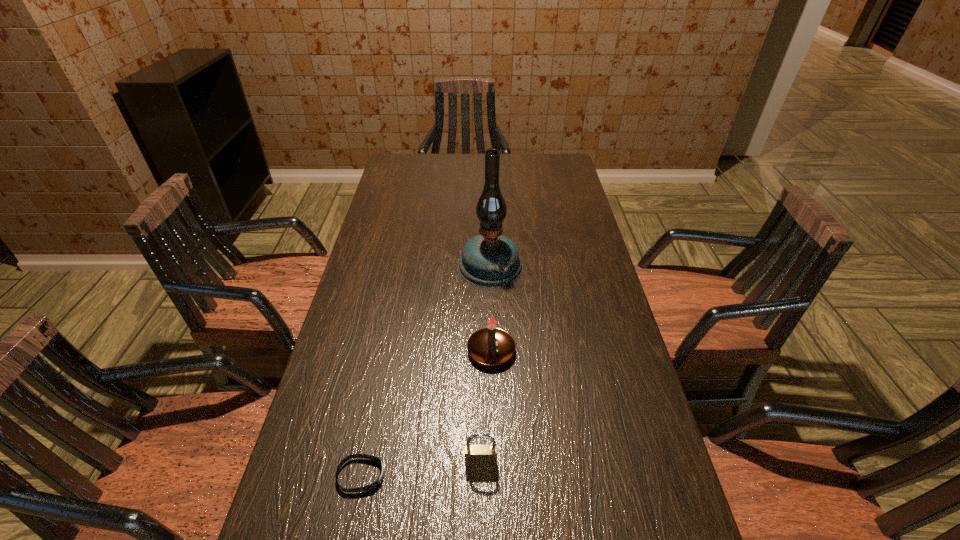
This screenshot has height=540, width=960. I want to click on vacant region between the farthest object and the leftmost object, so click(425, 370).

The height and width of the screenshot is (540, 960). I want to click on free space between the oil lamp and the leftmost object, so click(425, 370).

The height and width of the screenshot is (540, 960). I want to click on empty space that is in between the leftmost object and the padlock, so click(x=421, y=469).

Locate an element on the screen. vacant area that lies between the candle and the leftmost object is located at coordinates (426, 413).

This screenshot has width=960, height=540. Find the location of `empty location between the candle and the second shortest object`. empty location between the candle and the second shortest object is located at coordinates (486, 407).

Identify the location of object that can be found as the third closest to the farthest object. Image resolution: width=960 pixels, height=540 pixels. (372, 486).

Locate which object is the closest to the wristband. Please provide its 2D coordinates. Your answer should be formatted as a tuple, i.e. [(x, y)], where the tuple contains the x and y coordinates of a point satisfying the conditions above.

[(479, 456)]

Find the location of a particular element. The image size is (960, 540). free space that satisfies the following two spatial constraints: 1. on the front-facing side of the padlock; 2. on the display of the leftmost object is located at coordinates (481, 475).

Find the location of a particular element. vacant space that satisfies the following two spatial constraints: 1. on the front-facing side of the third tallest object; 2. on the display of the shortest object is located at coordinates (481, 475).

Identify the location of blank space that satisfies the following two spatial constraints: 1. on the front-facing side of the third tallest object; 2. on the display of the wristband. Image resolution: width=960 pixels, height=540 pixels. (481, 475).